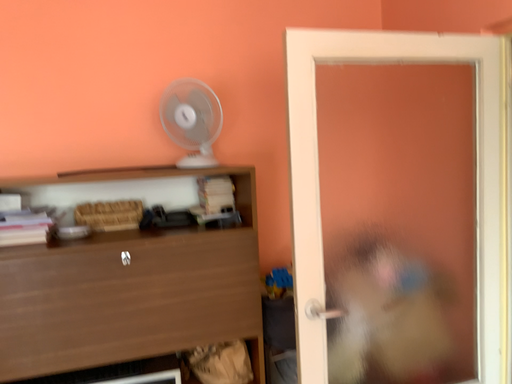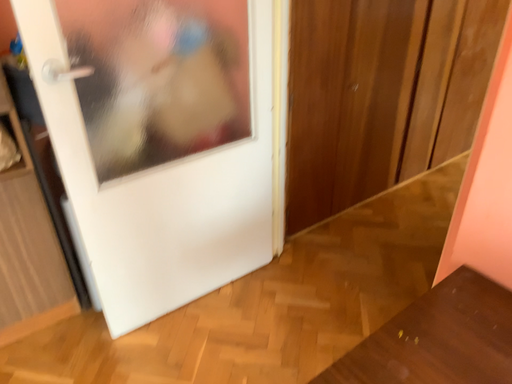
Question: How did the camera likely rotate when shooting the video?

Choices:
 (A) rotated upward
 (B) rotated downward

Answer: (B)